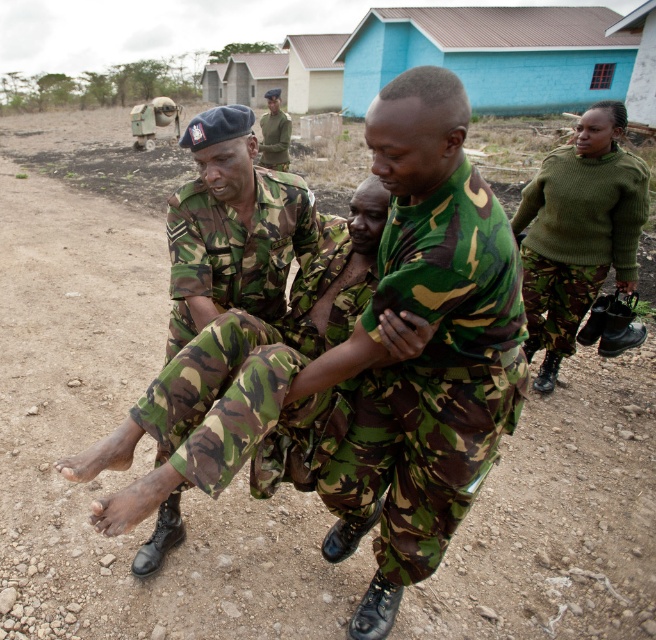
Does green knitted sweater at right appear under camouflage uniform at center?

Correct, green knitted sweater at right is located below camouflage uniform at center.

Which is more to the left, green knitted sweater at right or camouflage uniform at center?

From the viewer's perspective, camouflage uniform at center appears more on the left side.

This screenshot has width=656, height=640. I want to click on green knitted sweater at right, so click(x=579, y=230).

Between camo fabric pants at center and camouflage uniform at center, which one appears on the right side from the viewer's perspective?

Positioned to the right is camo fabric pants at center.

Which is behind, point (173, 429) or point (268, 118)?

Positioned behind is point (268, 118).

Locate an element on the screen. camo fabric pants at center is located at coordinates (256, 387).

Does camouflage fabric uniform at center have a lesser height compared to camouflage uniform at center?

Indeed, camouflage fabric uniform at center has a lesser height compared to camouflage uniform at center.

Is camouflage fabric uniform at center thinner than camouflage uniform at center?

Indeed, camouflage fabric uniform at center has a lesser width compared to camouflage uniform at center.

Locate an element on the screen. This screenshot has width=656, height=640. camouflage fabric uniform at center is located at coordinates 434,376.